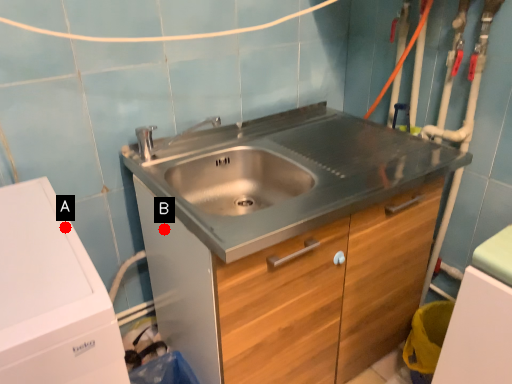
Question: Two points are circled on the image, labeled by A and B beside each circle. Which point is closer to the camera taking this photo?

Choices:
 (A) A is closer
 (B) B is closer

Answer: (A)